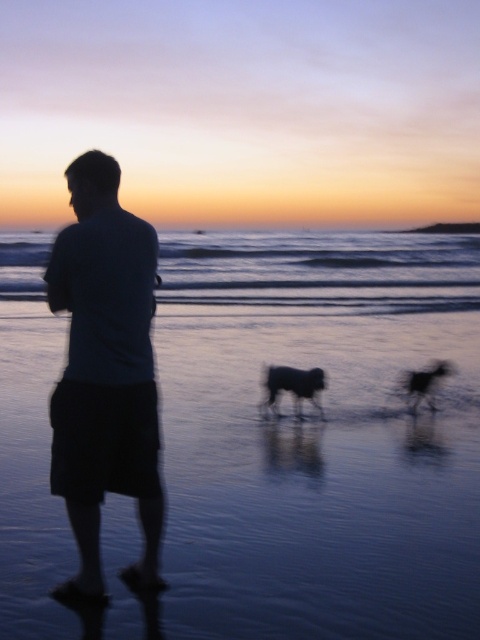
You are a photographer positioned at the center of the beach scene. You want to capture a photo that includes both the dark blue shirt at center and the black furry dog at center. Given that your camera has a 50mm lens with a field of view that can capture objects up to 10 feet apart, will you be able to fit both subjects in the frame without moving?

The dark blue shirt at center is 12.22 feet away from the black furry dog at center. Since the maximum distance your camera can capture is 10 feet, you will not be able to fit both subjects in the frame without moving closer or using a different lens.

You are a photographer trying to capture a photo of the dark blue shirt at center and the black furry dog at center. Which object should you focus on first if you want to ensure both are in the frame without moving the camera?

You should focus on the dark blue shirt at center first because it is larger in size than the black furry dog at center, making it easier to center and frame properly before adjusting for the smaller object.

You are standing at point [282,372] and want to walk to the beach horizon. There is a point at [178,264] behind you. Which direction should you walk to avoid stepping on the point behind you?

Since point [178,264] is behind point [282,372], you should walk forward towards the horizon to avoid stepping on the point behind you.